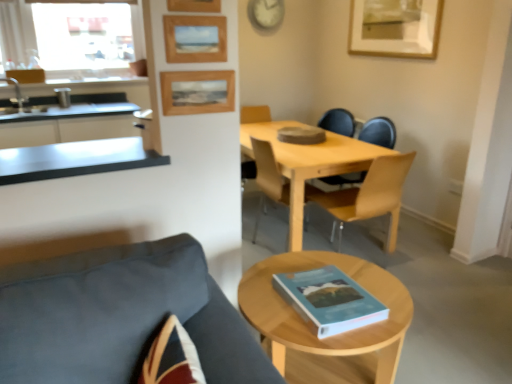
Question: From the image's perspective, is dark gray fabric chair at lower left, the third chair viewed from the back, above light wood table at center?

Choices:
 (A) no
 (B) yes

Answer: (A)

Question: Does dark gray fabric chair at lower left, acting as the first chair starting from the front, have a greater height compared to light wood table at center?

Choices:
 (A) yes
 (B) no

Answer: (A)

Question: From the image's perspective, does dark gray fabric chair at lower left, the third chair viewed from the back, appear lower than light wood table at center?

Choices:
 (A) yes
 (B) no

Answer: (A)

Question: From a real-world perspective, is dark gray fabric chair at lower left, the third chair viewed from the back, positioned over light wood table at center based on gravity?

Choices:
 (A) no
 (B) yes

Answer: (B)

Question: Is dark gray fabric chair at lower left, the third chair viewed from the back, to the right of light wood table at center from the viewer's perspective?

Choices:
 (A) yes
 (B) no

Answer: (B)

Question: Is wooden picture frame at upper right, which ranks as the 4th picture frame in left-to-right order, taller or shorter than wooden picture frame at upper center, the first picture frame viewed from the left?

Choices:
 (A) short
 (B) tall

Answer: (B)

Question: Is wooden picture frame at upper right, arranged as the fourth picture frame when ordered from the bottom, inside or outside of wooden picture frame at upper center, the first picture frame viewed from the left?

Choices:
 (A) inside
 (B) outside

Answer: (B)

Question: Would you say wooden picture frame at upper right, arranged as the 4th picture frame when viewed from the front, is to the left or to the right of wooden picture frame at upper center, the first picture frame viewed from the left, in the picture?

Choices:
 (A) right
 (B) left

Answer: (A)

Question: Is point (436, 16) closer or farther from the camera than point (194, 57)?

Choices:
 (A) closer
 (B) farther

Answer: (B)

Question: Relative to metallic gray countertop at left, is light wood coffee table at center in front or behind?

Choices:
 (A) front
 (B) behind

Answer: (A)

Question: Based on their positions, is light wood coffee table at center located to the left or right of metallic gray countertop at left?

Choices:
 (A) right
 (B) left

Answer: (A)

Question: Which is correct: light wood coffee table at center is inside metallic gray countertop at left, or outside of it?

Choices:
 (A) outside
 (B) inside

Answer: (A)

Question: From the image's perspective, is light wood coffee table at center located above or below metallic gray countertop at left?

Choices:
 (A) below
 (B) above

Answer: (A)

Question: In terms of size, does dark gray fabric chair at lower left, the third chair viewed from the back, appear bigger or smaller than light wood table at center?

Choices:
 (A) big
 (B) small

Answer: (B)

Question: From the image's perspective, relative to light wood table at center, is dark gray fabric chair at lower left, acting as the first chair starting from the front, above or below?

Choices:
 (A) above
 (B) below

Answer: (B)